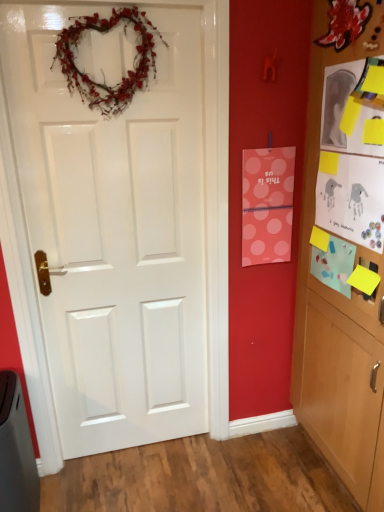
Question: Would you say wooden cabinet at right contains white glossy door at center?

Choices:
 (A) yes
 (B) no

Answer: (B)

Question: Is wooden cabinet at right wider than white glossy door at center?

Choices:
 (A) no
 (B) yes

Answer: (B)

Question: Does wooden cabinet at right have a lesser height compared to white glossy door at center?

Choices:
 (A) yes
 (B) no

Answer: (B)

Question: Considering the relative positions of wooden cabinet at right and white glossy door at center in the image provided, is wooden cabinet at right in front of white glossy door at center?

Choices:
 (A) no
 (B) yes

Answer: (B)

Question: From the image's perspective, is wooden cabinet at right beneath white glossy door at center?

Choices:
 (A) yes
 (B) no

Answer: (B)

Question: From a real-world perspective, is white paper postcard at upper right, which is the 1th postcard from right to left, above or below pink polka dot paper at upper right, placed as the 3th postcard when sorted from right to left?

Choices:
 (A) above
 (B) below

Answer: (A)

Question: Looking at their shapes, would you say white paper postcard at upper right, which is the 1th postcard from right to left, is wider or thinner than pink polka dot paper at upper right, the 1th postcard from the left?

Choices:
 (A) thin
 (B) wide

Answer: (A)

Question: Considering the relative positions of white paper postcard at upper right, which is the 1th postcard from right to left, and pink polka dot paper at upper right, the 1th postcard from the left, in the image provided, is white paper postcard at upper right, which is the 1th postcard from right to left, to the left or to the right of pink polka dot paper at upper right, the 1th postcard from the left,?

Choices:
 (A) left
 (B) right

Answer: (B)

Question: Would you say white paper postcard at upper right, the third postcard when ordered from left to right, is inside or outside pink polka dot paper at upper right, the 1th postcard from the left?

Choices:
 (A) outside
 (B) inside

Answer: (A)

Question: Is wooden cabinet at right spatially inside matte blue paper at right, which is counted as the second postcard, starting from the right, or outside of it?

Choices:
 (A) inside
 (B) outside

Answer: (B)

Question: Looking at the image, does wooden cabinet at right seem bigger or smaller compared to matte blue paper at right, which is counted as the second postcard, starting from the right?

Choices:
 (A) small
 (B) big

Answer: (B)

Question: Is wooden cabinet at right taller or shorter than matte blue paper at right, which is counted as the second postcard, starting from the right?

Choices:
 (A) short
 (B) tall

Answer: (B)

Question: Considering their positions, is wooden cabinet at right located in front of or behind matte blue paper at right, which ranks as the second postcard in left-to-right order?

Choices:
 (A) behind
 (B) front

Answer: (B)

Question: In terms of height, does matte blue paper at right, which is counted as the second postcard, starting from the right, look taller or shorter compared to white paper postcard at upper right, the third postcard when ordered from left to right?

Choices:
 (A) tall
 (B) short

Answer: (B)

Question: From the image's perspective, relative to white paper postcard at upper right, which is the 1th postcard from right to left, is matte blue paper at right, which is counted as the second postcard, starting from the right, above or below?

Choices:
 (A) below
 (B) above

Answer: (A)